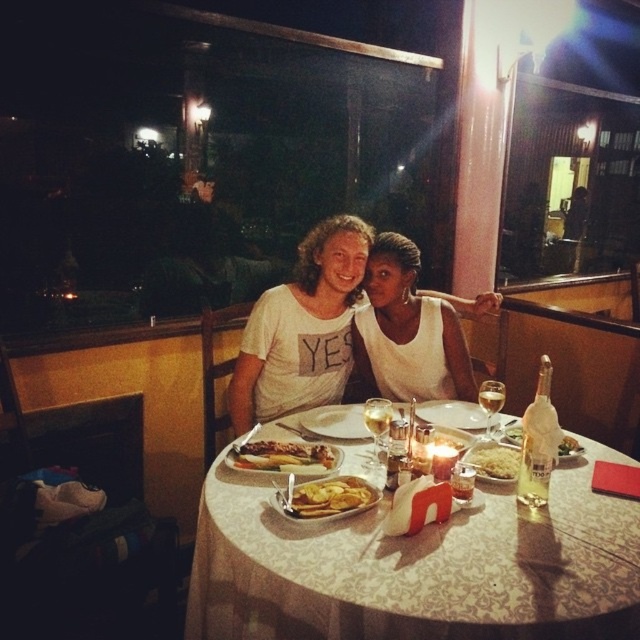
Looking at this image, you are a server at the restaurant and need to place a new dish on the table. The dish is wider than the yellow crispy chips at center but narrower than the matte glass plate at center. Where can you place the new dish on the table?

You can place the new dish on the table between the matte glass plate at center and the yellow crispy chips at center since the dish is narrower than the matte glass plate at center and wider than the yellow crispy chips at center.

You are a waiter at this outdoor dining area. You need to place a new dessert plate on the table. Which object, the white lace tablecloth at center or the white cotton shirt at center, should you place the plate on to ensure it stays stable?

The white lace tablecloth at center is larger in size than the white cotton shirt at center, so placing the dessert plate on the white lace tablecloth at center would provide a more stable and spacious surface.